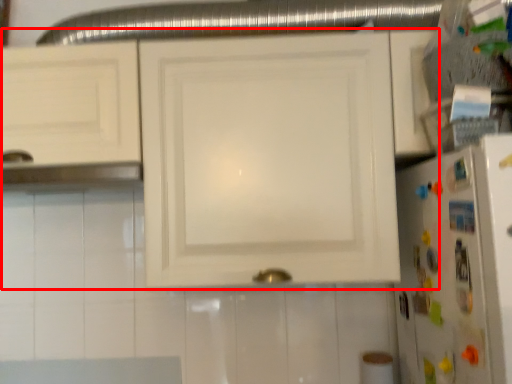
Question: From the image's perspective, considering the relative positions of cabinetry (annotated by the red box) and refrigerator in the image provided, where is cabinetry (annotated by the red box) located with respect to the staircase?

Choices:
 (A) below
 (B) above

Answer: (B)